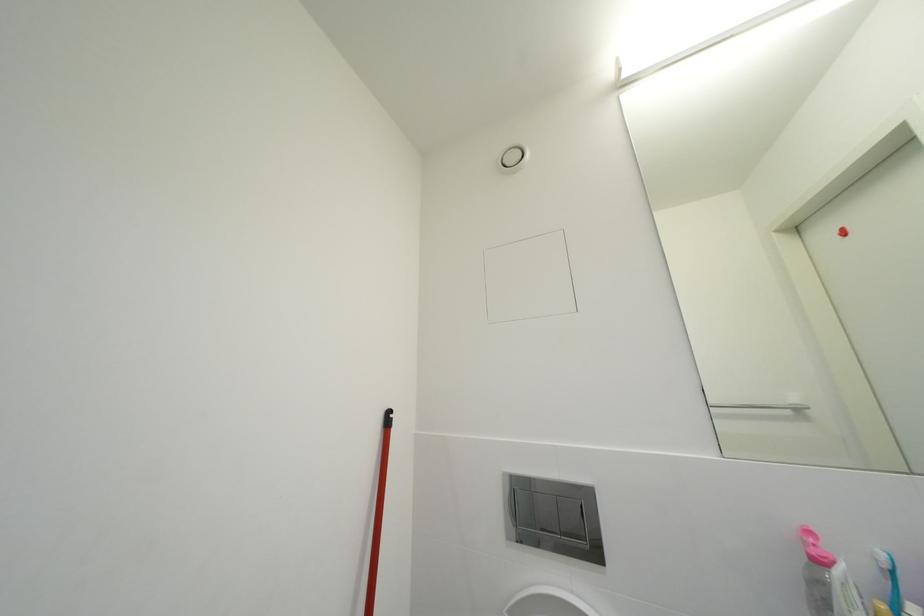
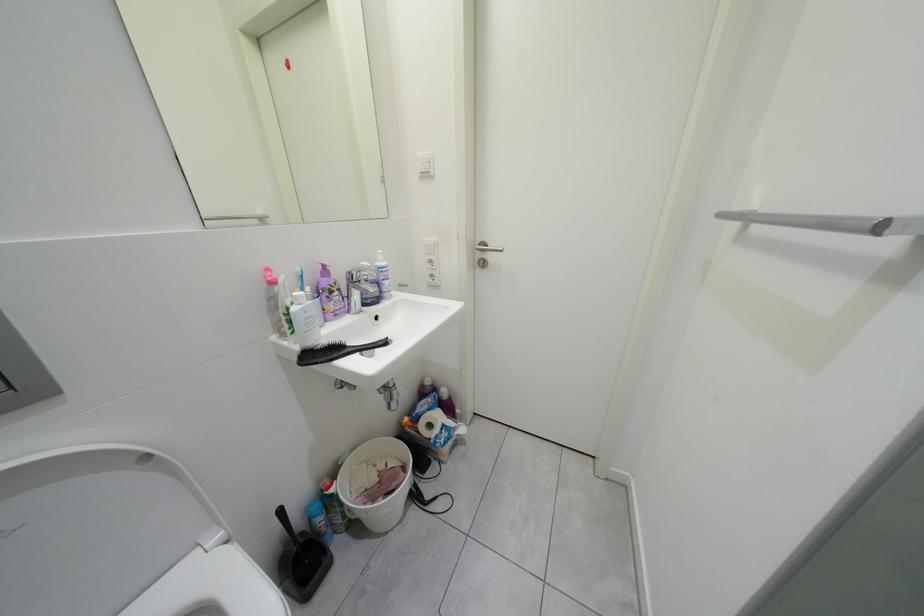
Based on the photo, first-person continuous shooting, in which direction is the camera rotating?

The camera's rotation is toward right-down.